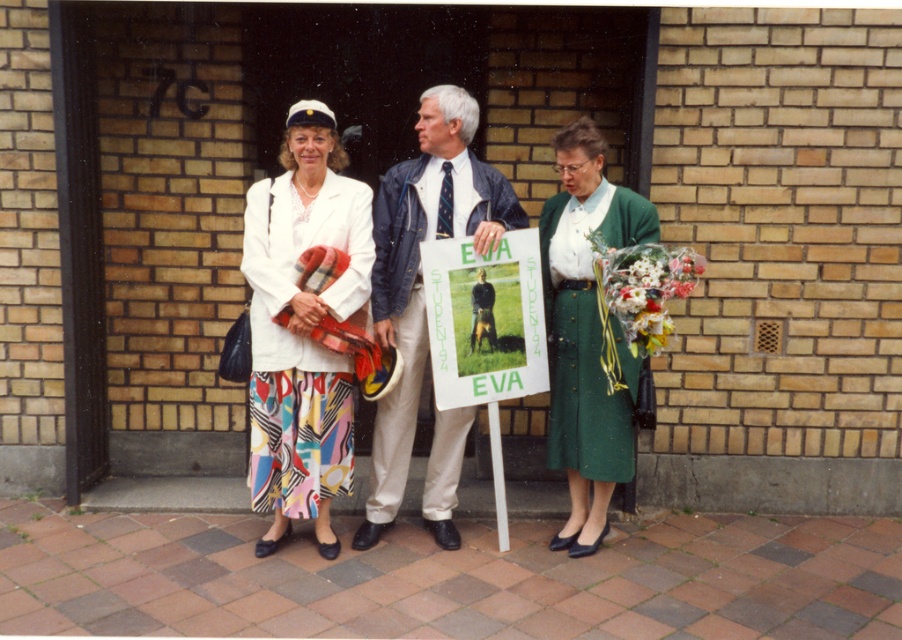
You are standing in front of the building and want to find the white cotton jacket at center. According to the coordinates provided, where should you look relative to the center of the image?

The white cotton jacket at center is located at the coordinates point [419,269], which is slightly to the right and above the center of the image.

You are a fashion designer observing the two jackets at the event. Which jacket, the denim jacket at center or the white cotton jacket at center, would you recommend to a client who wants a more voluminous look?

The denim jacket at center is larger in size than the white cotton jacket at center, so I would recommend the denim jacket at center for a more voluminous look.

You are a photographer trying to capture a clear photo of the sign held by the man in the center. The sign is between the denim jacket at center and the white cotton jacket at center. Can you fit the sign in your camera frame if the maximum distance your camera can focus on is 1.5 centimeters?

The distance between the denim jacket at center and the white cotton jacket at center is 1.34 centimeters, which is less than the camera focus range of 1.5 centimeters. Therefore, the sign can be captured clearly within the frame.